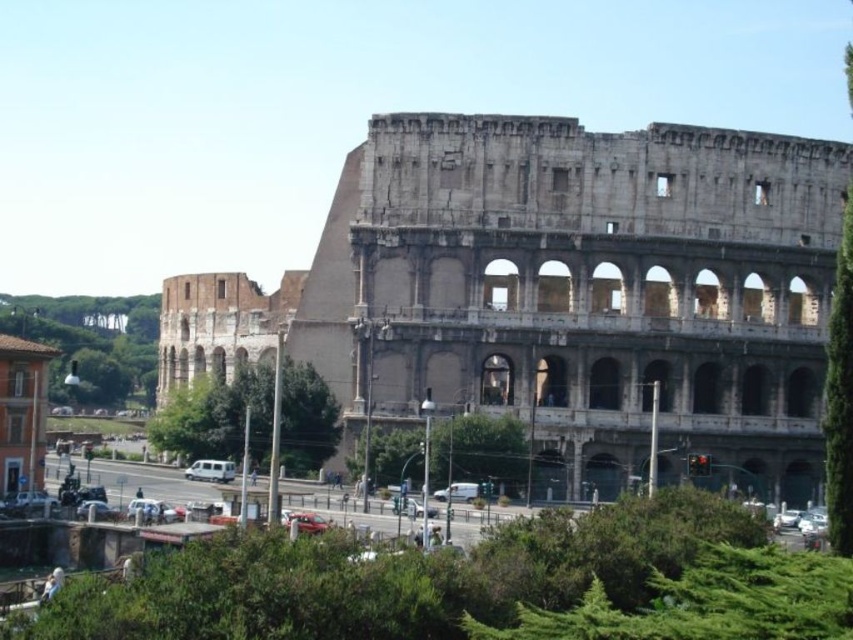
Which of these two, gray stone amphitheater at center or white matte van at center, stands shorter?

Standing shorter between the two is white matte van at center.

Does gray stone amphitheater at center have a lesser height compared to white matte van at center?

No, gray stone amphitheater at center is not shorter than white matte van at center.

Find the location of a particular element. gray stone amphitheater at center is located at coordinates (560, 292).